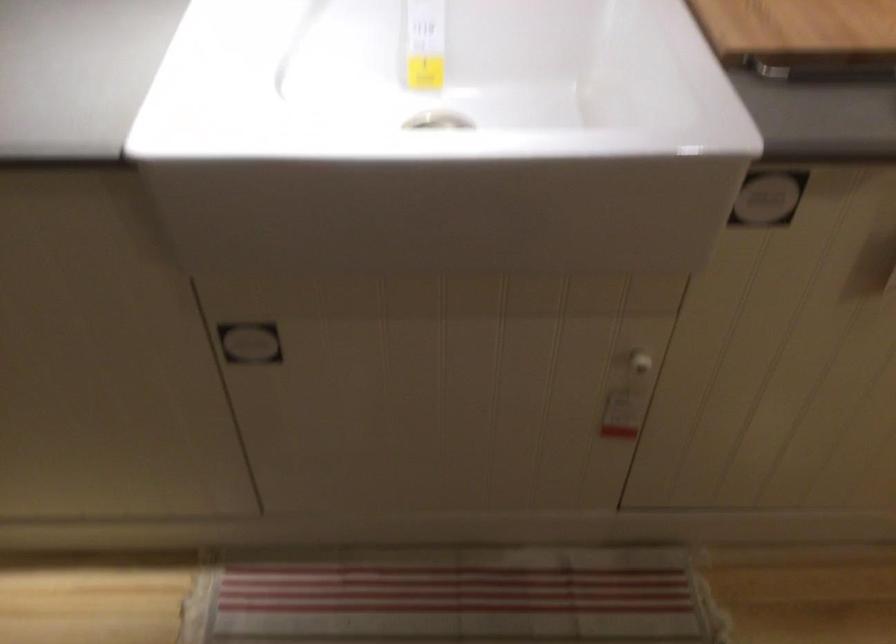
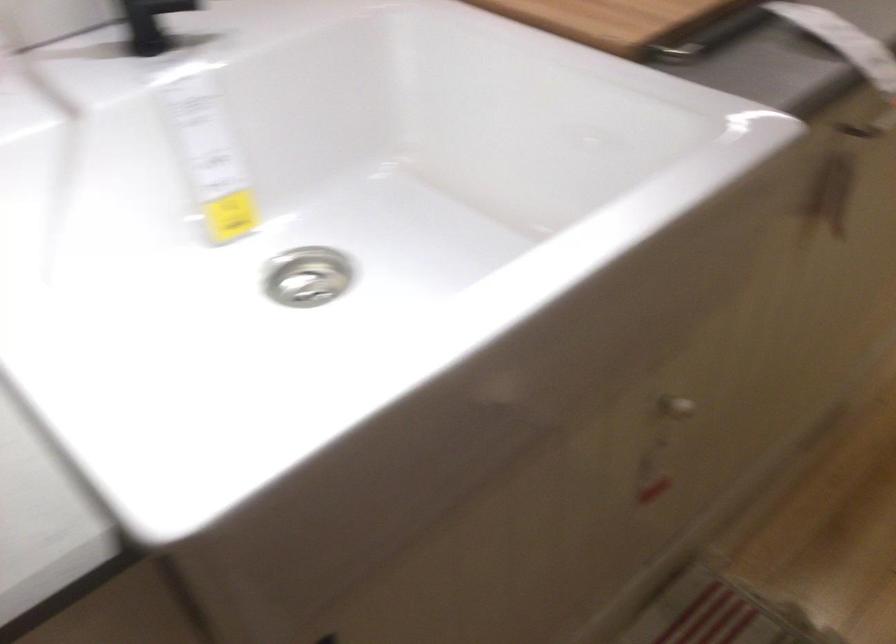
Question: How did the camera likely rotate?

Choices:
 (A) Left
 (B) Right
 (C) Up
 (D) Down

Answer: (B)